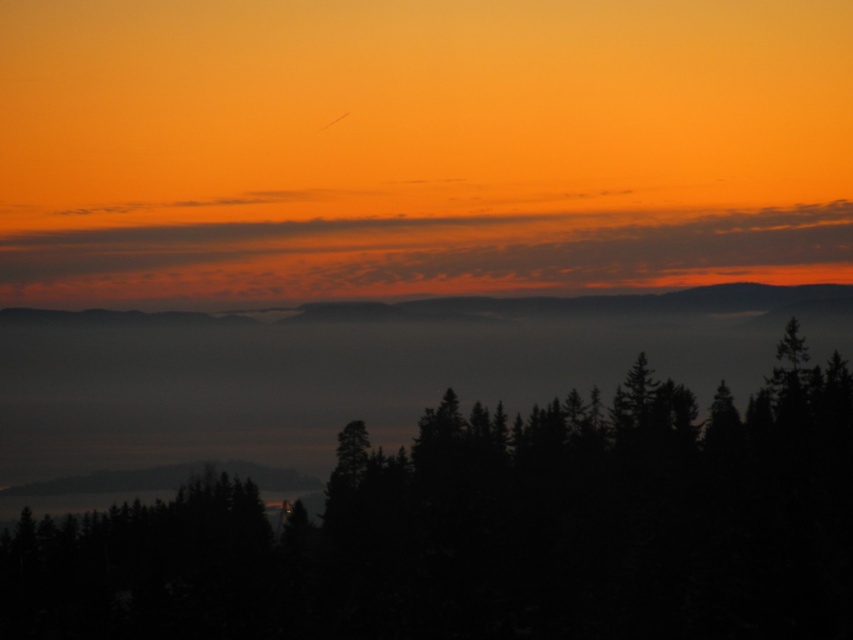
Measure the distance between dark green textured trees at lower center and matte orange sky at upper center.

The distance of dark green textured trees at lower center from matte orange sky at upper center is 906.75 feet.

Can you confirm if dark green textured trees at lower center is positioned above matte orange sky at upper center?

No, dark green textured trees at lower center is not above matte orange sky at upper center.

The image size is (853, 640). What do you see at coordinates (491, 531) in the screenshot? I see `dark green textured trees at lower center` at bounding box center [491, 531].

The height and width of the screenshot is (640, 853). Identify the location of dark green textured trees at lower center. [x=491, y=531].